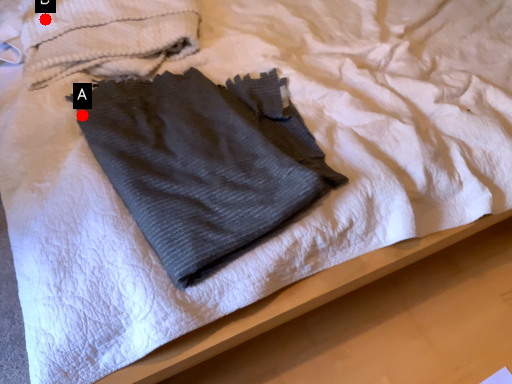
Question: Two points are circled on the image, labeled by A and B beside each circle. Which point is closer to the camera?

Choices:
 (A) A is closer
 (B) B is closer

Answer: (A)